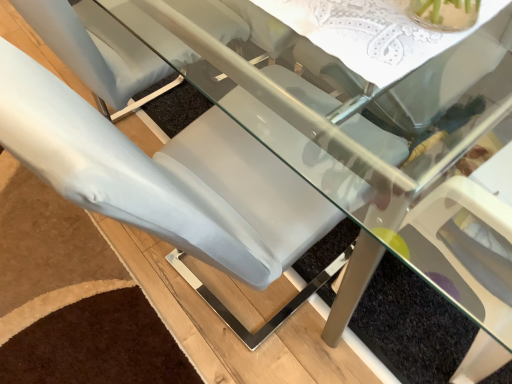
This screenshot has height=384, width=512. What do you see at coordinates (164, 176) in the screenshot? I see `white matte chair at lower left` at bounding box center [164, 176].

I want to click on white matte chair at lower left, so (x=164, y=176).

This screenshot has width=512, height=384. I want to click on white matte chair at lower left, so click(x=164, y=176).